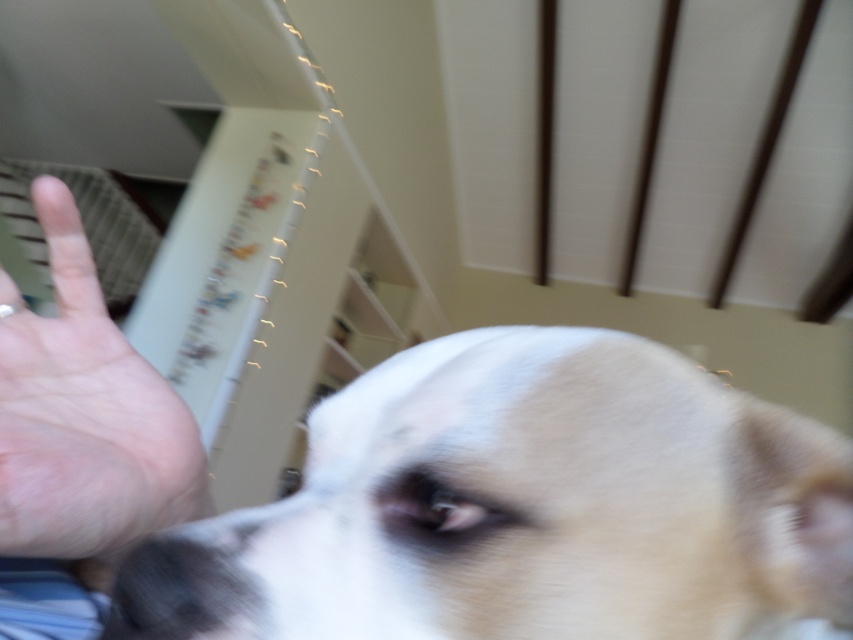
Question: Does white fur dog at center have a larger size compared to pale skin palm at upper left?

Choices:
 (A) no
 (B) yes

Answer: (B)

Question: Does white fur dog at center appear under pale skin palm at upper left?

Choices:
 (A) yes
 (B) no

Answer: (A)

Question: Which object appears closest to the camera in this image?

Choices:
 (A) white fur dog at center
 (B) pale skin palm at upper left

Answer: (A)

Question: Is white fur dog at center behind pale skin palm at upper left?

Choices:
 (A) yes
 (B) no

Answer: (B)

Question: Which point is closer to the camera?

Choices:
 (A) pale skin palm at upper left
 (B) white fur dog at center

Answer: (B)

Question: Which of the following is the farthest from the observer?

Choices:
 (A) white fur dog at center
 (B) pale skin palm at upper left

Answer: (B)